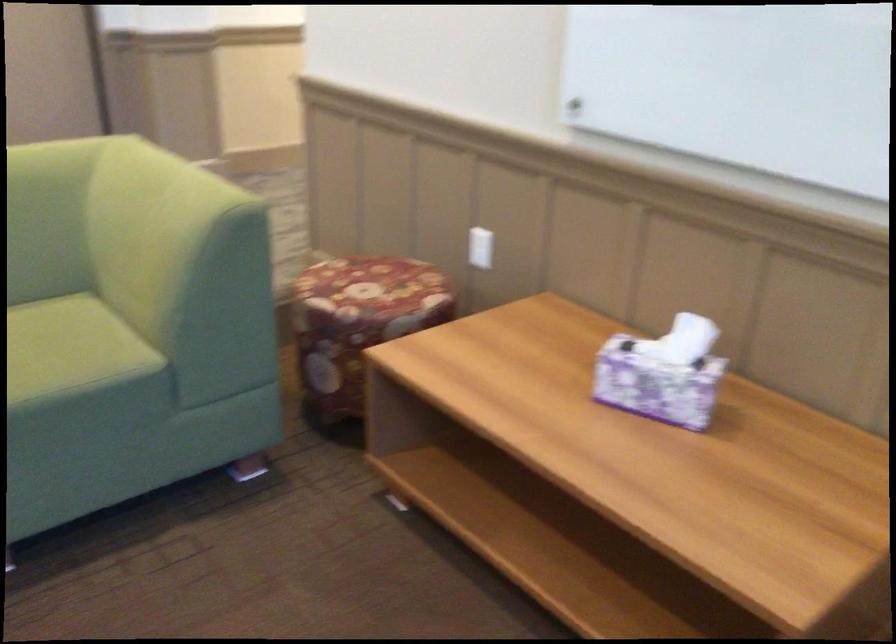
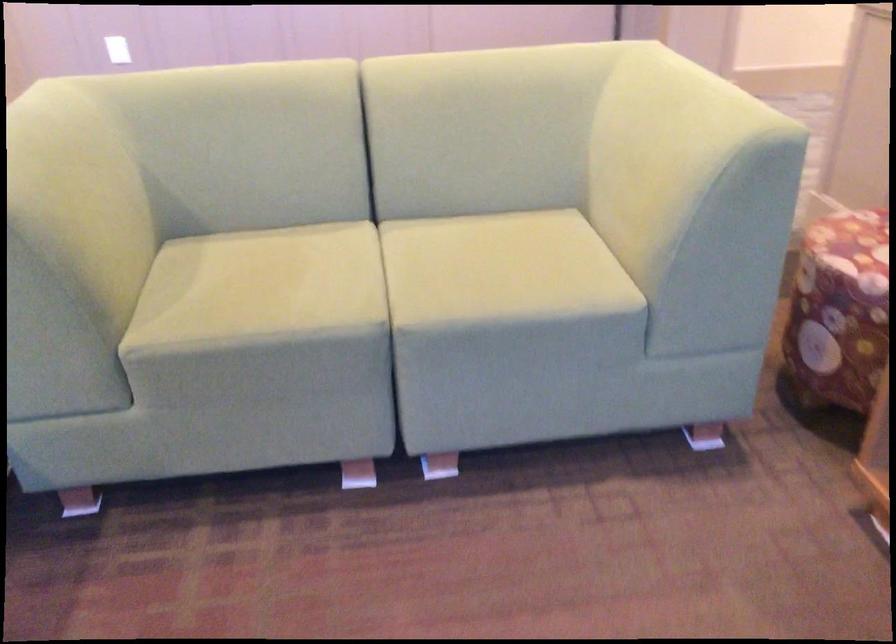
In the second image, find the point that corresponds to pixel 328 279 in the first image.

(851, 231)